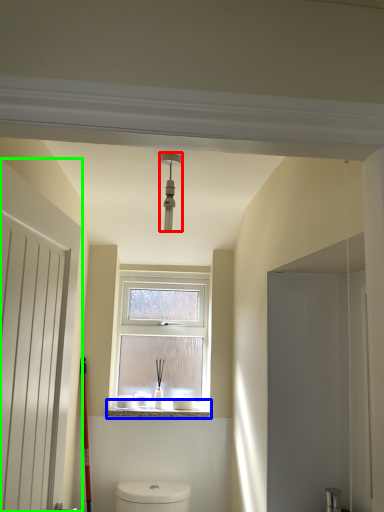
Question: Which object is the farthest from light fixture (highlighted by a red box)? Choose among these: window sill (highlighted by a blue box) or door (highlighted by a green box).

Choices:
 (A) window sill
 (B) door

Answer: (A)